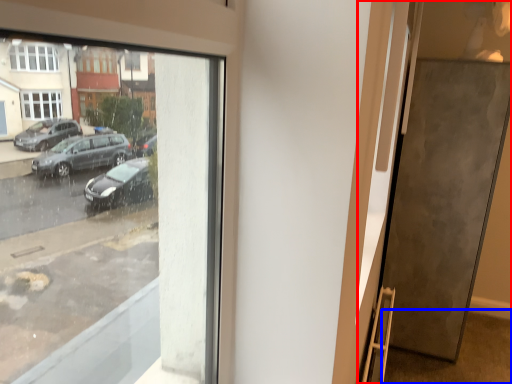
Question: Which point is closer to the camera, door (highlighted by a red box) or pavement (highlighted by a blue box)?

Choices:
 (A) door
 (B) pavement

Answer: (B)